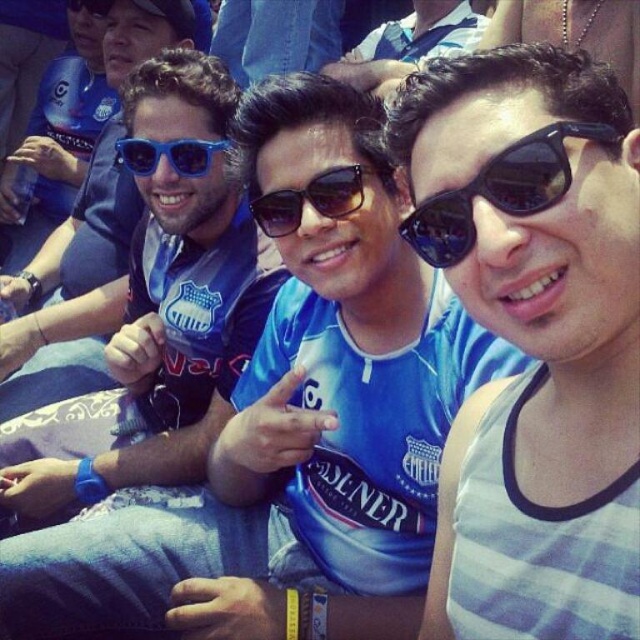
Question: Does black reflective sunglasses at upper right have a lesser width compared to blue plastic sunglasses at center?

Choices:
 (A) yes
 (B) no

Answer: (A)

Question: Which of the following is the farthest from the observer?

Choices:
 (A) blue plastic sunglasses at center
 (B) sunglasses at center
 (C) matte blue jersey at center

Answer: (A)

Question: Which point is closer to the camera?

Choices:
 (A) blue plastic sunglasses at center
 (B) matte blue jersey at center

Answer: (B)

Question: Which of the following is the farthest from the observer?

Choices:
 (A) (211, 154)
 (B) (209, 115)

Answer: (B)

Question: Is black reflective sunglasses at upper right to the left of sunglasses at center from the viewer's perspective?

Choices:
 (A) no
 (B) yes

Answer: (A)

Question: Does matte blue jersey at center lie in front of blue plastic sunglasses at center?

Choices:
 (A) no
 (B) yes

Answer: (B)